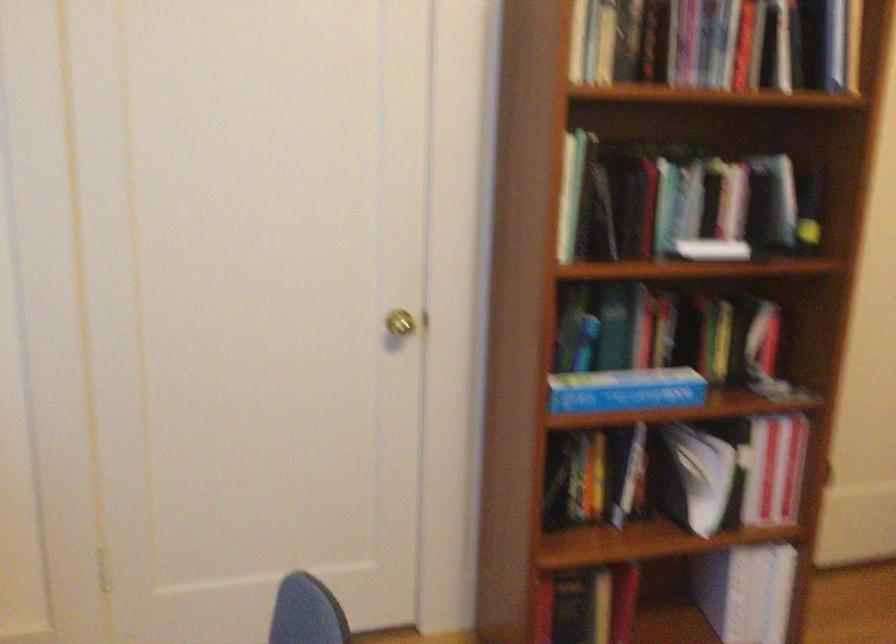
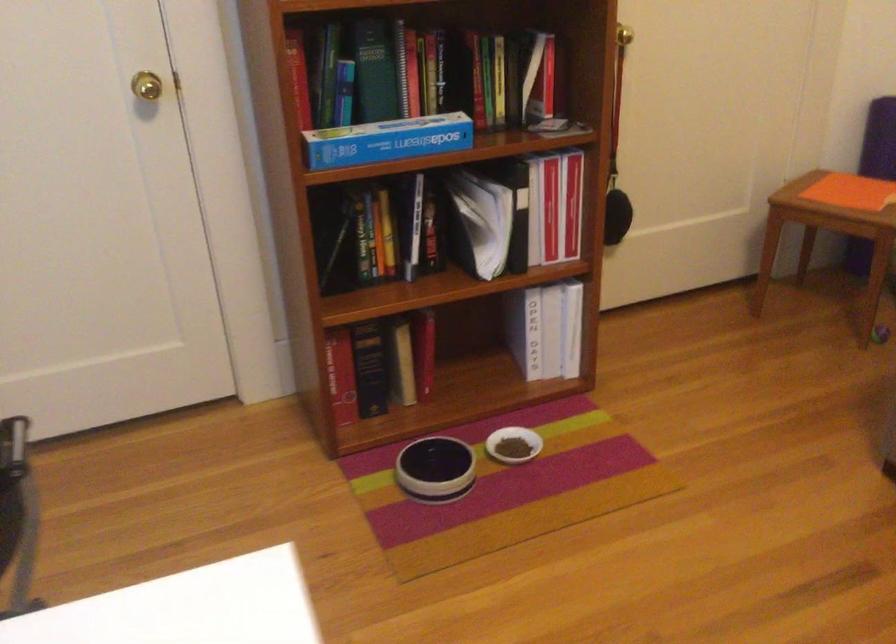
Locate, in the second image, the point that corresponds to (695,478) in the first image.

(479, 222)